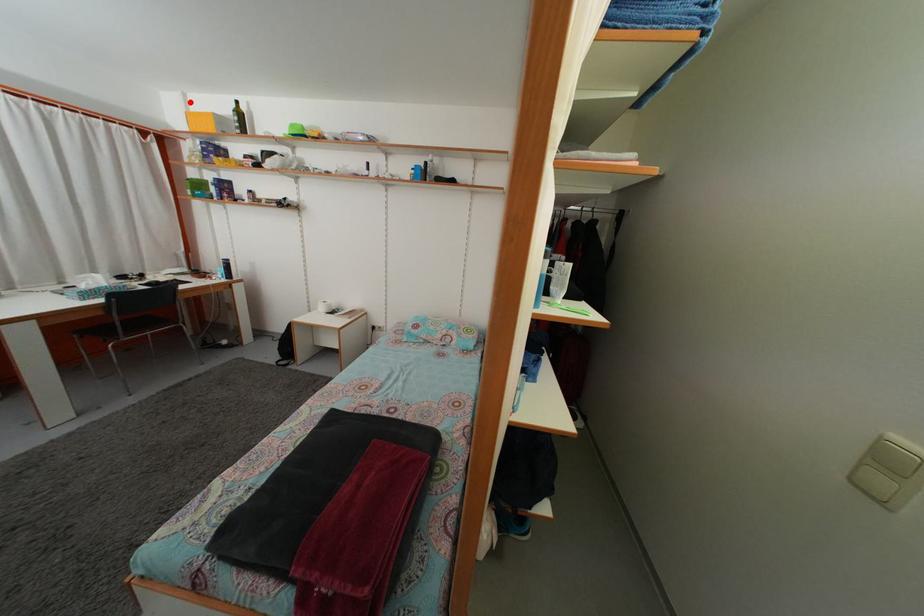
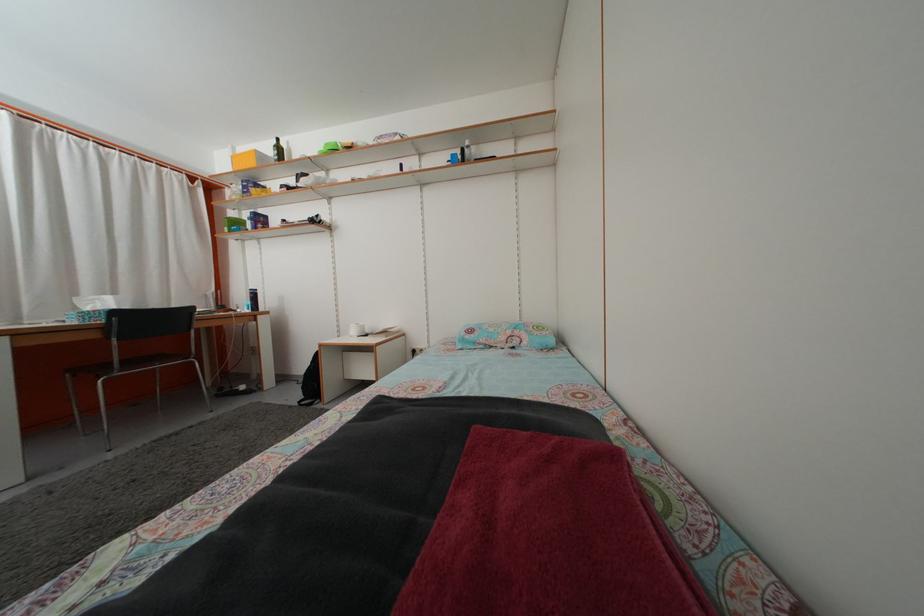
Question: I am providing you with two images of the same scene from different viewpoints. Given a red point in image1, look at the same physical point in image2. Is it:

Choices:
 (A) Closer to the viewpoint
 (B) Farther from the viewpoint

Answer: (A)